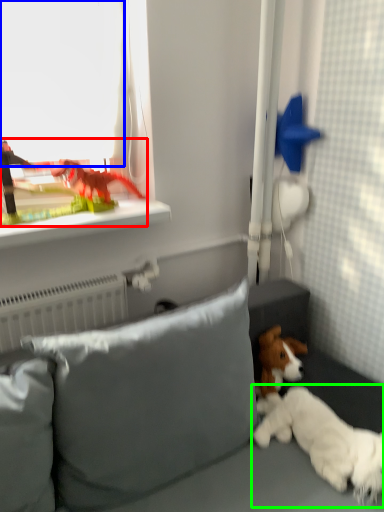
Question: Which is farther away from toy (highlighted by a red box)? window screen (highlighted by a blue box) or dog (highlighted by a green box)?

Choices:
 (A) window screen
 (B) dog

Answer: (B)